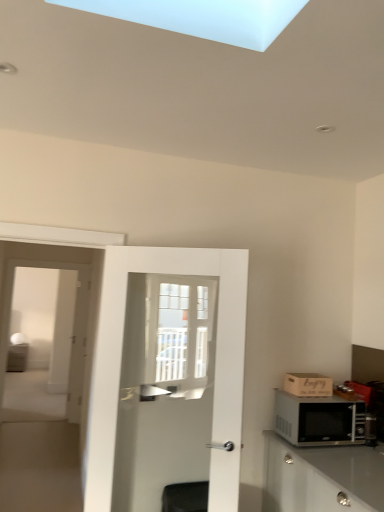
I want to click on free space above white glass screen door at left (from a real-world perspective), so click(x=53, y=225).